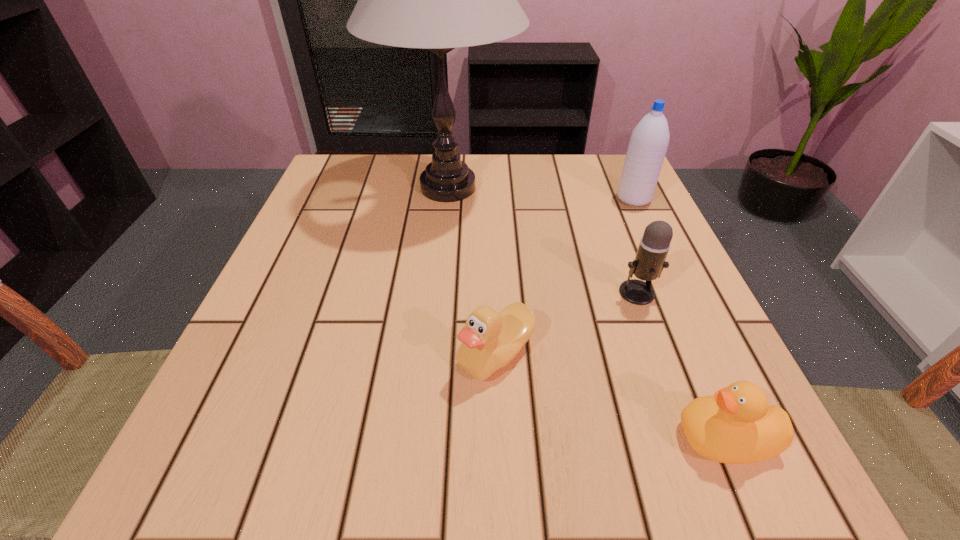
Find the location of a particular element. object positioned at the left edge is located at coordinates (438, 0).

Where is `water bottle that is at the right edge`? The height and width of the screenshot is (540, 960). water bottle that is at the right edge is located at coordinates (647, 148).

I want to click on microphone positioned at the right edge, so click(x=649, y=262).

In order to click on duck positioned at the right edge in this screenshot , I will do `click(736, 425)`.

Locate an element on the screen. This screenshot has height=540, width=960. object that is at the far left corner is located at coordinates (438, 0).

I want to click on object at the far right corner, so click(x=647, y=148).

Identify the location of object present at the near right corner. The image size is (960, 540). (736, 425).

This screenshot has height=540, width=960. What are the coordinates of `vacant space at the far edge of the desktop` in the screenshot? It's located at [x=466, y=199].

This screenshot has height=540, width=960. I want to click on vacant point at the near edge, so click(x=588, y=434).

Where is `free space at the left edge`? free space at the left edge is located at coordinates (230, 413).